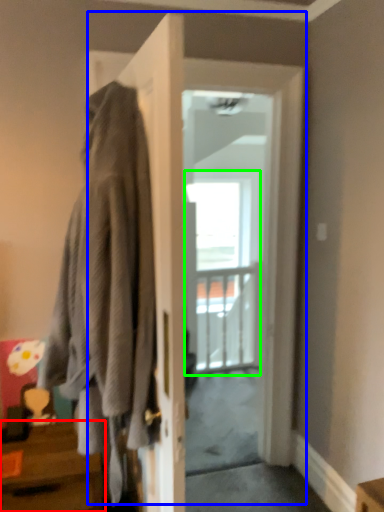
Question: Estimate the real-world distances between objects in this image. Which object is farther from table (highlighted by a red box), door (highlighted by a blue box) or glass door (highlighted by a green box)?

Choices:
 (A) door
 (B) glass door

Answer: (B)